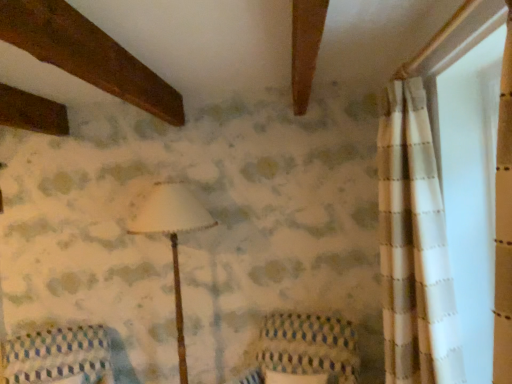
Question: Is knitted fabric armchair at center in front of or behind patterned fabric cushion at lower left in the image?

Choices:
 (A) behind
 (B) front

Answer: (B)

Question: Visually, is knitted fabric armchair at center positioned to the left or to the right of patterned fabric cushion at lower left?

Choices:
 (A) right
 (B) left

Answer: (A)

Question: Which object is positioned closest to the white matte lampshade at center?

Choices:
 (A) patterned fabric cushion at lower left
 (B) knitted fabric armchair at center

Answer: (B)

Question: Which of these objects is positioned closest to the knitted fabric armchair at center?

Choices:
 (A) white matte lampshade at center
 (B) patterned fabric cushion at lower left

Answer: (A)